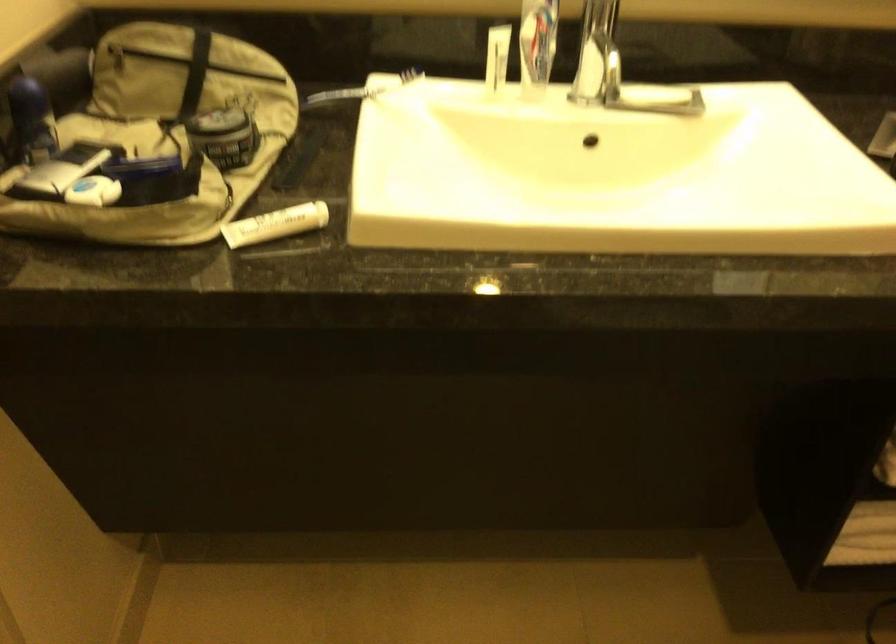
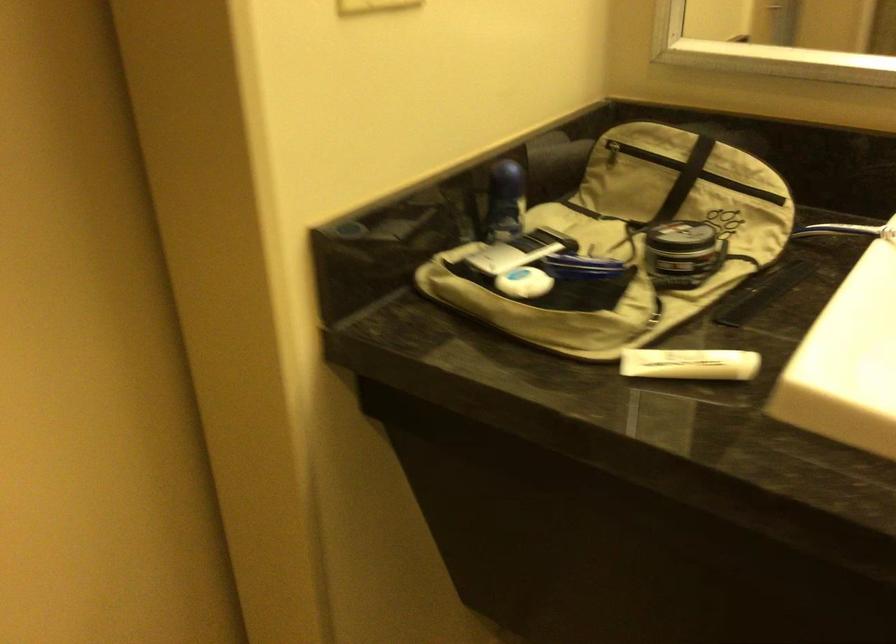
Question: The images are taken continuously from a first-person perspective. In which direction is your viewpoint rotating?

Choices:
 (A) Left
 (B) Right
 (C) Up
 (D) Down

Answer: (A)